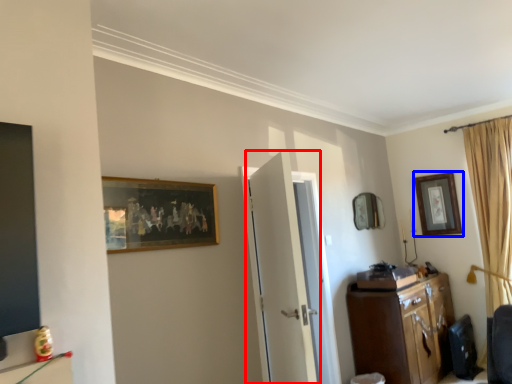
Question: Which point is closer to the camera, door (highlighted by a red box) or picture frame (highlighted by a blue box)?

Choices:
 (A) door
 (B) picture frame

Answer: (A)